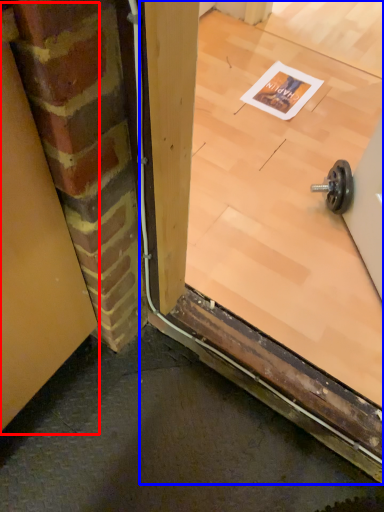
Question: Which object is closer to the camera taking this photo, garage door (highlighted by a red box) or window (highlighted by a blue box)?

Choices:
 (A) garage door
 (B) window

Answer: (A)